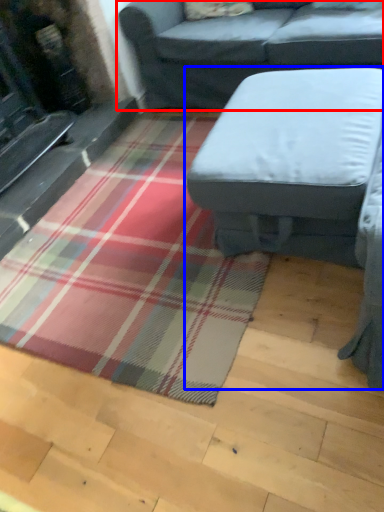
Question: Which point is further to the camera, studio couch (highlighted by a red box) or studio couch (highlighted by a blue box)?

Choices:
 (A) studio couch
 (B) studio couch

Answer: (A)